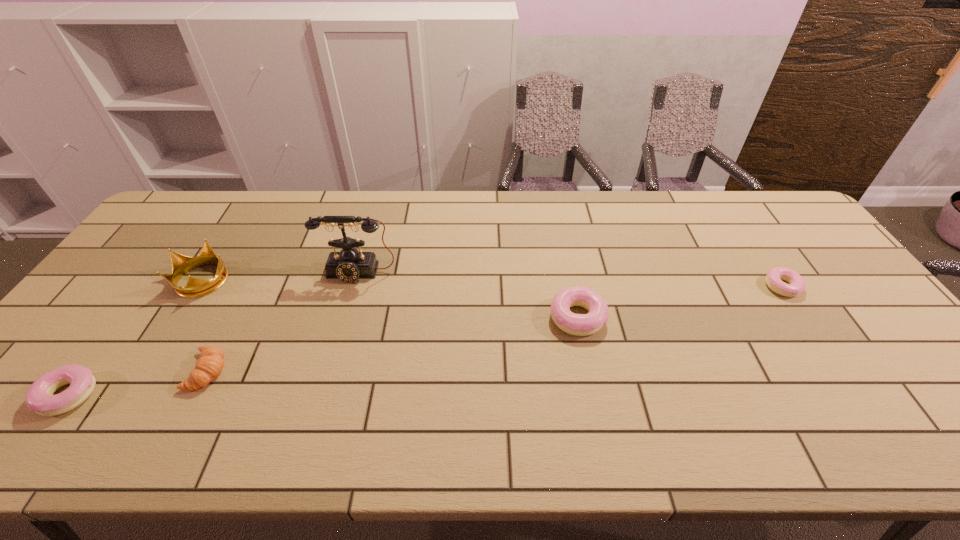
At what (x,y) coordinates should I click in order to perform the action: click on object that is at the right edge. Please return your answer as a coordinate pair (x, y). Image resolution: width=960 pixels, height=540 pixels. Looking at the image, I should click on (774, 277).

Where is `object that is at the near left corner`? object that is at the near left corner is located at coordinates (39, 398).

Where is `free space at the far edge`? The image size is (960, 540). free space at the far edge is located at coordinates (414, 220).

In the image, there is a desktop. At what (x,y) coordinates should I click in order to perform the action: click on vacant space at the near edge. Please return your answer as a coordinate pair (x, y). This screenshot has height=540, width=960. Looking at the image, I should click on (778, 385).

In the image, there is a desktop. In order to click on vacant area at the left edge in this screenshot , I will do `click(123, 337)`.

At what (x,y) coordinates should I click in order to perform the action: click on empty space between the nearest doughnut and the telephone. Please return your answer as a coordinate pair (x, y). Looking at the image, I should click on (213, 334).

Where is `unoccupied position between the shortest object and the fifth object from right to left`? This screenshot has width=960, height=540. unoccupied position between the shortest object and the fifth object from right to left is located at coordinates (493, 283).

The height and width of the screenshot is (540, 960). What are the coordinates of `unoccupied area between the nearest doughnut and the third tallest object` in the screenshot? It's located at (323, 356).

Find the location of a particular element. Image resolution: width=960 pixels, height=540 pixels. unoccupied area between the leftmost object and the tallest object is located at coordinates (213, 334).

Where is `vacant point located between the tallest object and the crown`? vacant point located between the tallest object and the crown is located at coordinates (281, 276).